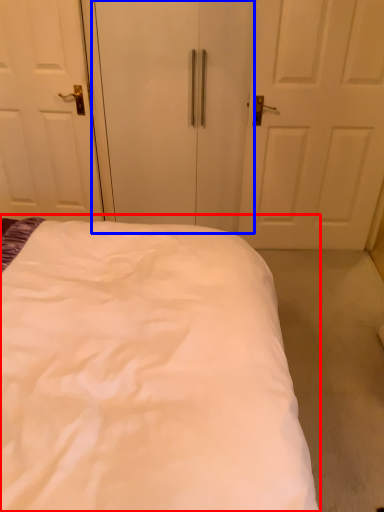
Question: Among these objects, which one is farthest to the camera, bed (highlighted by a red box) or screen door (highlighted by a blue box)?

Choices:
 (A) bed
 (B) screen door

Answer: (B)